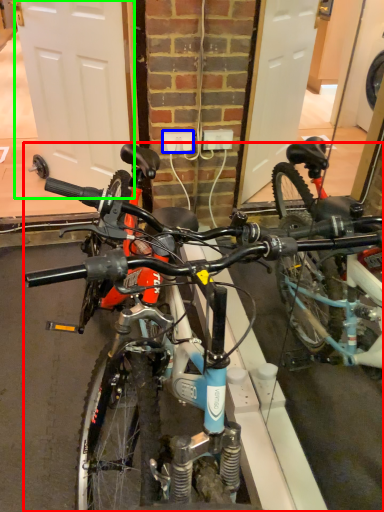
Question: Which object is positioned farthest from bicycle (highlighted by a red box)? Select from power outlet (highlighted by a blue box) and garage door (highlighted by a green box).

Choices:
 (A) power outlet
 (B) garage door

Answer: (B)